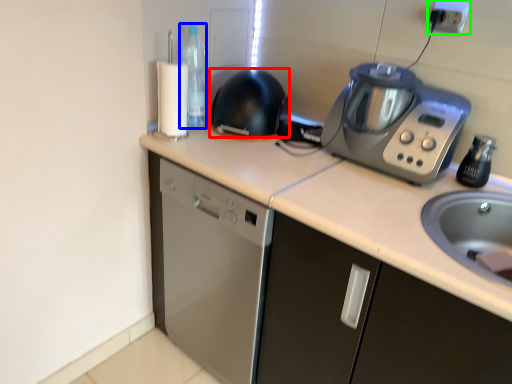
Question: Based on their relative distances, which object is farther from kitchen appliance (highlighted by a red box)? Choose from bottle (highlighted by a blue box) and electric outlet (highlighted by a green box).

Choices:
 (A) bottle
 (B) electric outlet

Answer: (B)